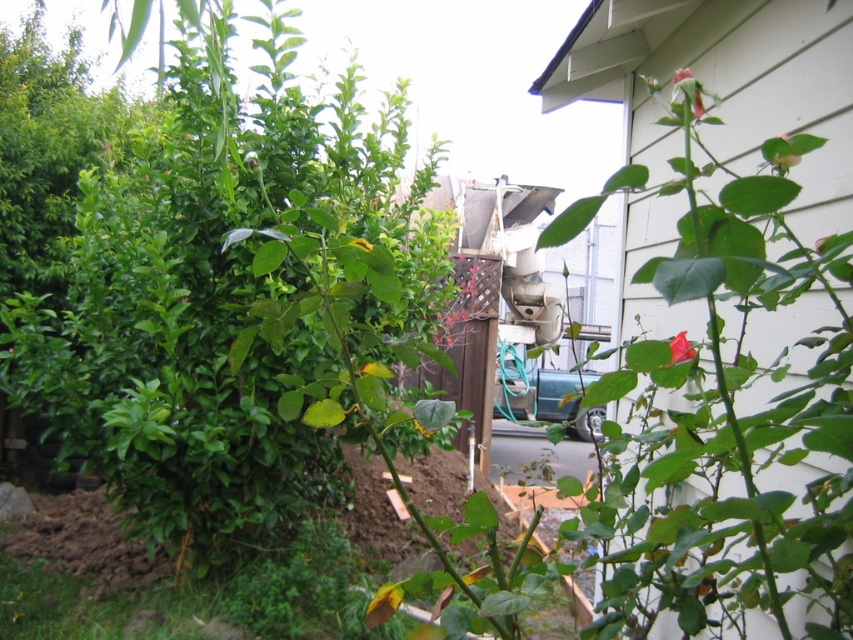
You are standing in the garden and want to locate the green leafy bush at center. According to the coordinates provided, where would you find it?

The green leafy bush at center is located at point coordinates of (218, 298).

Based on the photo, you are a gardener looking at the garden scene. You need to water the pink matte rosebud at upper right and the pink matte rose at upper center. Which one should you water first if you want to start with the one that is nearest to you?

You should water the pink matte rosebud at upper right first because it is closer to the viewer than the pink matte rose at upper center.